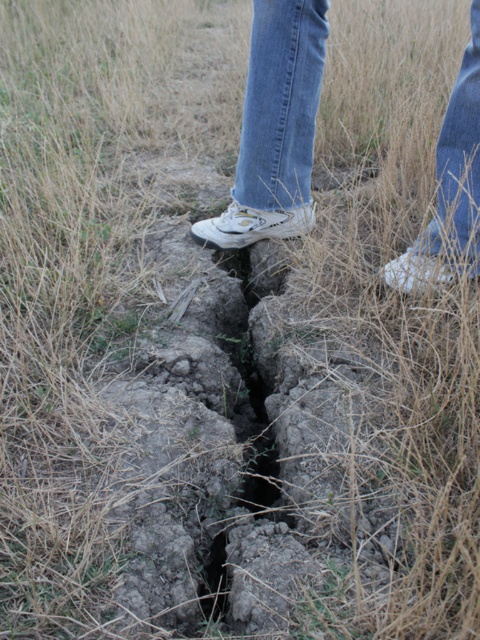
You are standing at point (478,262) and want to walk to point (314,120). Given the cracked earth fissure in the scene, will you have to step over the fissure to reach your destination?

Point (314,120) is behind point (478,262), so you will not have to step over the fissure to reach your destination since it is already behind your current position.

Looking at this image, you are standing at the point marked as point (275, 125) in the image. What object is located exactly at that coordinate?

The point (275, 125) corresponds to the white canvas sneakers at center.

You are a photographer trying to capture the depth of the fissure in the cracked earth. You notice two points marked on your screen at coordinates point (427, 253) and point (243, 180). Which point should you focus on to emphasize the depth of the fissure?

Point (427, 253) is closer to the camera than point (243, 180). To emphasize the depth of the fissure, focus on the point that is closer to the camera, which is point (427, 253).